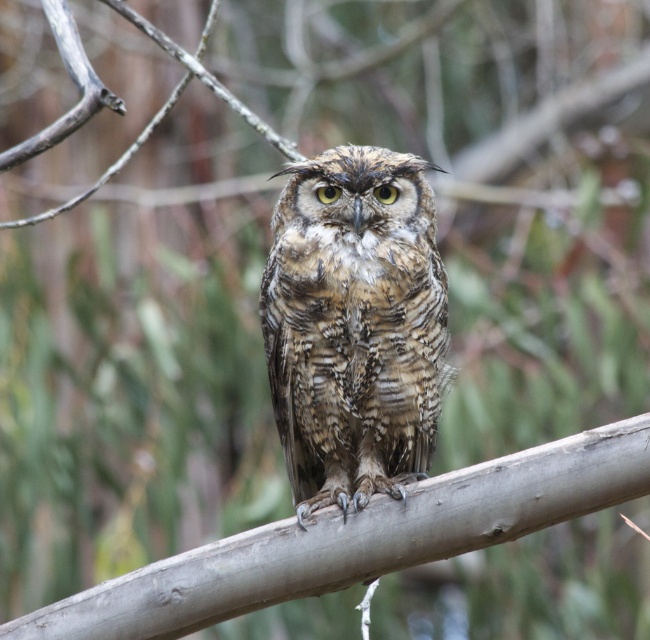
Can you confirm if brown textured owl at center is positioned to the right of gray smooth branch at center?

Correct, you'll find brown textured owl at center to the right of gray smooth branch at center.

Consider the image. Is brown textured owl at center to the left of gray smooth branch at center from the viewer's perspective?

Incorrect, brown textured owl at center is not on the left side of gray smooth branch at center.

Which is in front, point (372, 264) or point (135, 620)?

Point (135, 620) is more forward.

Where is `brown textured owl at center`? The image size is (650, 640). brown textured owl at center is located at coordinates (354, 324).